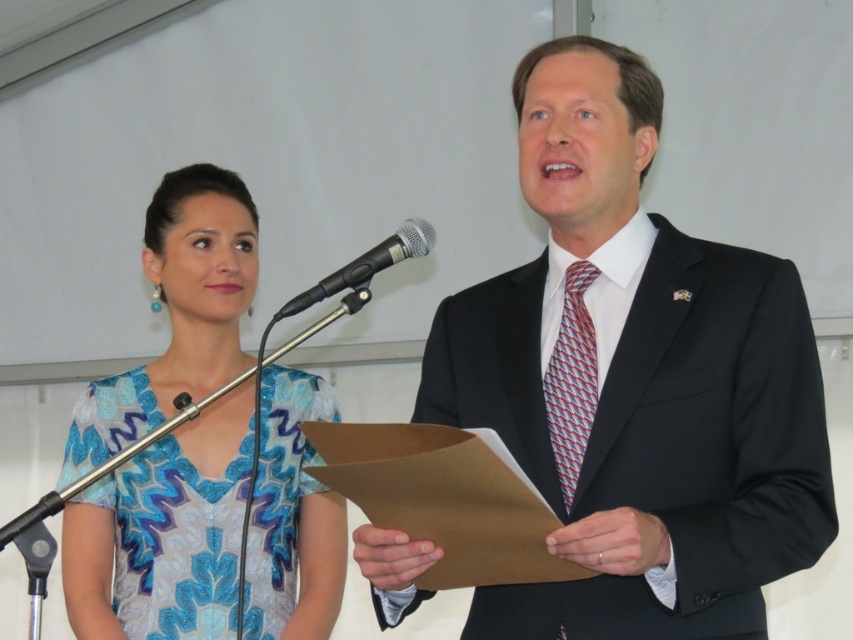
Question: Among these objects, which one is nearest to the camera?

Choices:
 (A) black suit at center
 (B) black metallic microphone at center

Answer: (A)

Question: Among these objects, which one is nearest to the camera?

Choices:
 (A) shiny blue dress at center
 (B) black metallic microphone at center
 (C) black suit at center

Answer: (C)

Question: Observing the image, what is the correct spatial positioning of black suit at center in reference to black metallic microphone at center?

Choices:
 (A) left
 (B) right

Answer: (B)

Question: Does black suit at center appear under black metallic microphone at center?

Choices:
 (A) yes
 (B) no

Answer: (A)

Question: Does black suit at center appear on the left side of shiny blue dress at center?

Choices:
 (A) no
 (B) yes

Answer: (A)

Question: Which point is farther to the camera?

Choices:
 (A) (289, 310)
 (B) (527, 380)
 (C) (68, 531)

Answer: (C)